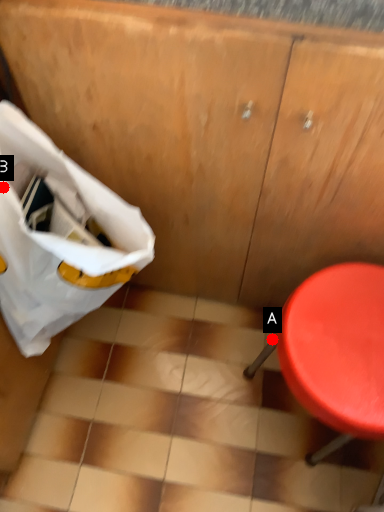
Question: Two points are circled on the image, labeled by A and B beside each circle. Which of the following is the closest to the observer?

Choices:
 (A) A is closer
 (B) B is closer

Answer: (B)